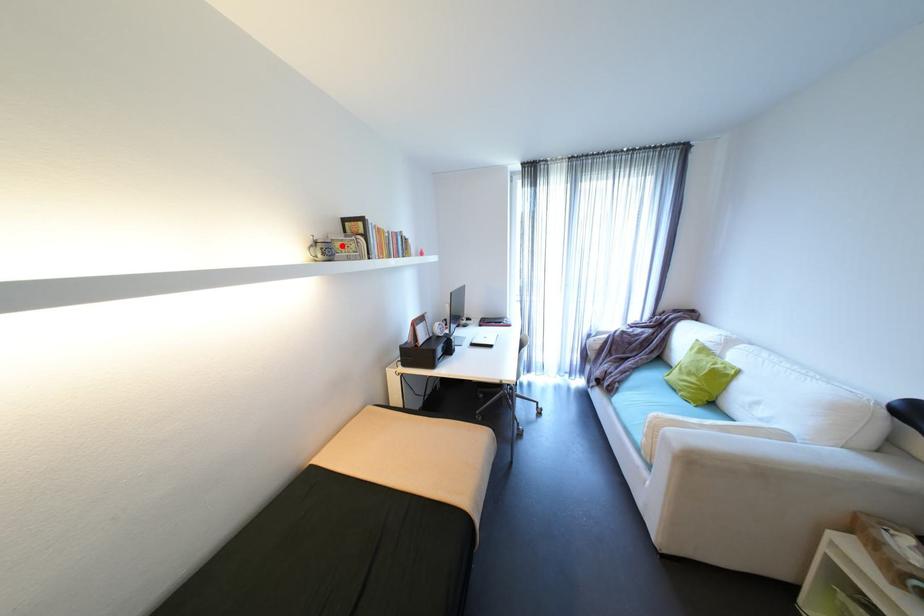
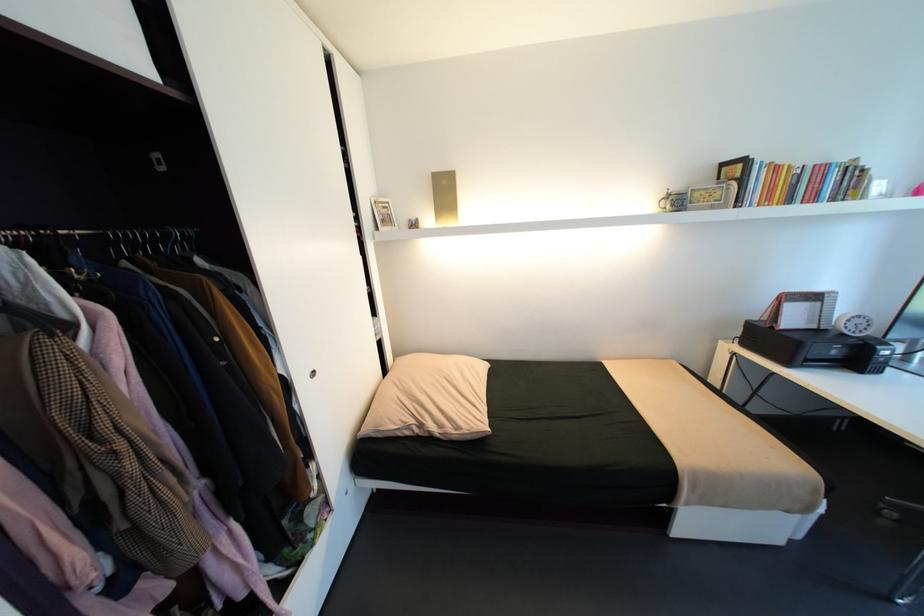
Question: I am providing you with two images of the same scene from different viewpoints. A red point is marked on the first image. At the location where the point appears in image 1, is it still visible in image 2?

Choices:
 (A) Yes
 (B) No

Answer: (A)